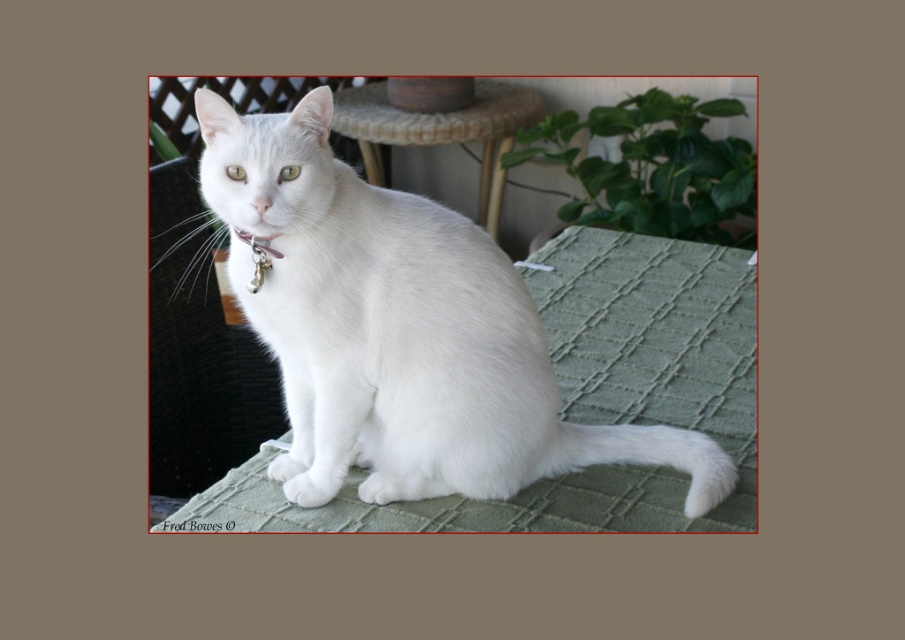
You are a photographer trying to capture the white fur cat at center. You need to position your camera at a specific coordinate to ensure the cat is centered in the frame. Given the cat is at point 0.517, 0.442, what coordinate should you aim for to center it?

The white fur cat at center is located at point (399, 330), so you should aim your camera at those coordinates to center it in the frame.

You are trying to place a new decorative item on the green woven table at center, but there is a white fur cat at center sitting there. Based on their sizes, do you think the cat is blocking the entire table?

The white fur cat at center might be wider than green woven table at center, so it is likely blocking the entire table.

You are a delivery robot that needs to place a small package on the green woven table at center without disturbing the white fur cat at center. Given that the robot requires 6 feet of space to maneuver safely, can you safely navigate to the table?

The white fur cat at center and green woven table at center are 5.93 feet apart. Since the robot needs 6 feet of space to maneuver safely, it cannot safely navigate to the table without potentially disturbing the cat.